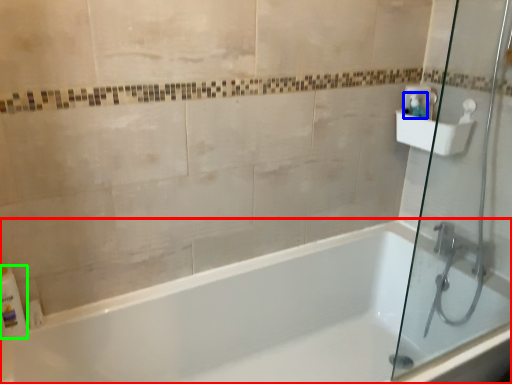
Question: Based on their relative distances, which object is farther from bathtub (highlighted by a red box)? Choose from soap dispenser (highlighted by a blue box) and toiletry (highlighted by a green box).

Choices:
 (A) soap dispenser
 (B) toiletry

Answer: (A)